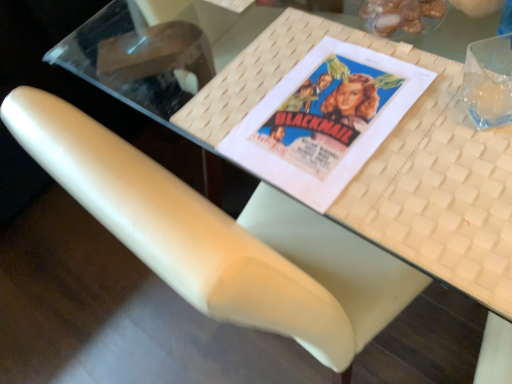
At what (x,y) coordinates should I click in order to perform the action: click on blank space above white woven placemat at upper center (from a real-world perspective). Please return your answer as a coordinate pair (x, y). Looking at the image, I should click on (382, 129).